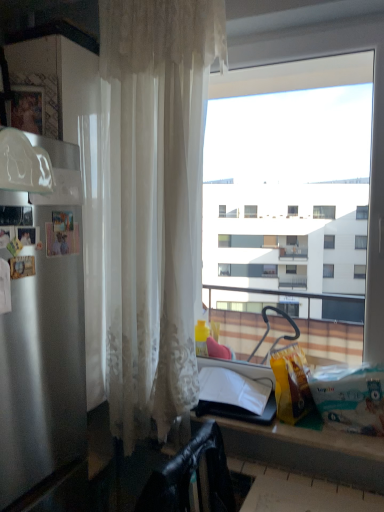
Question: Can you confirm if satin silver refrigerator at left is taller than matte black counter at lower center?

Choices:
 (A) yes
 (B) no

Answer: (A)

Question: Can you confirm if satin silver refrigerator at left is bigger than matte black counter at lower center?

Choices:
 (A) no
 (B) yes

Answer: (B)

Question: From a real-world perspective, is satin silver refrigerator at left below matte black counter at lower center?

Choices:
 (A) no
 (B) yes

Answer: (A)

Question: Is satin silver refrigerator at left positioned far away from matte black counter at lower center?

Choices:
 (A) no
 (B) yes

Answer: (A)

Question: Would you say satin silver refrigerator at left is outside matte black counter at lower center?

Choices:
 (A) yes
 (B) no

Answer: (A)

Question: Considering their positions, is black leather chair at lower left located in front of or behind transparent glass window at center?

Choices:
 (A) behind
 (B) front

Answer: (B)

Question: In the image, is black leather chair at lower left on the left side or the right side of transparent glass window at center?

Choices:
 (A) left
 (B) right

Answer: (A)

Question: Is black leather chair at lower left spatially inside transparent glass window at center, or outside of it?

Choices:
 (A) inside
 (B) outside

Answer: (B)

Question: From the image's perspective, relative to transparent glass window at center, is black leather chair at lower left above or below?

Choices:
 (A) above
 (B) below

Answer: (B)

Question: Is point (155, 496) closer or farther from the camera than point (304, 459)?

Choices:
 (A) farther
 (B) closer

Answer: (B)

Question: In the image, is black leather chair at lower left positioned in front of or behind matte black counter at lower center?

Choices:
 (A) front
 (B) behind

Answer: (B)

Question: Would you say black leather chair at lower left is inside or outside matte black counter at lower center?

Choices:
 (A) inside
 (B) outside

Answer: (A)

Question: Would you say black leather chair at lower left is to the left or to the right of matte black counter at lower center in the picture?

Choices:
 (A) right
 (B) left

Answer: (B)

Question: From a real-world perspective, is matte black counter at lower center positioned above or below black leather chair at lower left?

Choices:
 (A) below
 (B) above

Answer: (B)

Question: Is point (324, 456) positioned closer to the camera than point (152, 489)?

Choices:
 (A) farther
 (B) closer

Answer: (A)